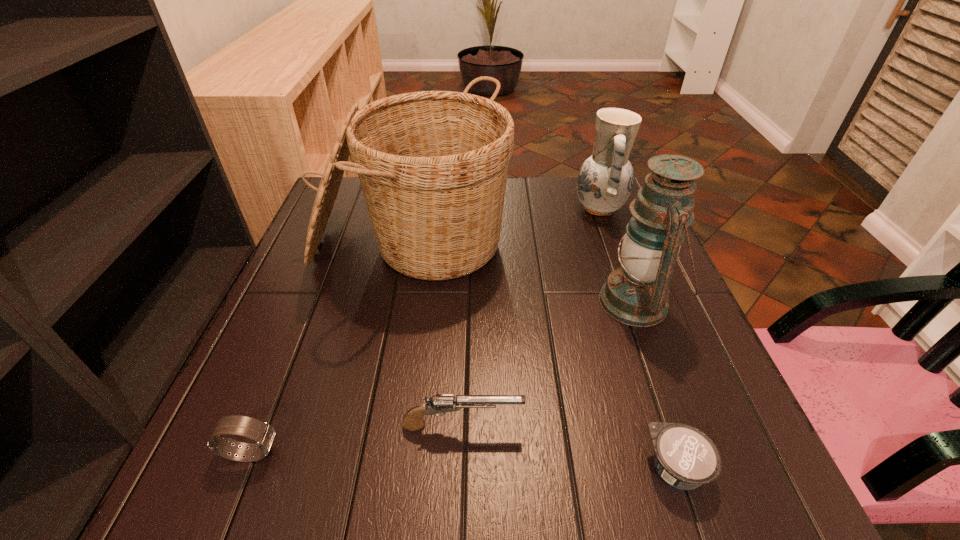
The width and height of the screenshot is (960, 540). Identify the location of basket. (433, 165).

Locate an element on the screen. oil lamp is located at coordinates 636,294.

Where is `the third tallest object`? Image resolution: width=960 pixels, height=540 pixels. the third tallest object is located at coordinates (605, 180).

Find the location of a particular element. watch is located at coordinates (263, 434).

Locate an element on the screen. the third nearest object is located at coordinates (437, 405).

The image size is (960, 540). I want to click on the shortest object, so click(685, 457).

I want to click on free region located on the front of the basket, so click(x=387, y=385).

Locate an element on the screen. This screenshot has width=960, height=540. free point located on the back of the oil lamp is located at coordinates (601, 204).

What are the coordinates of `vacant space located on either side of the pottery` in the screenshot? It's located at (466, 208).

Find the location of `blank space located 0.270m on either side of the pottery`. blank space located 0.270m on either side of the pottery is located at coordinates (476, 208).